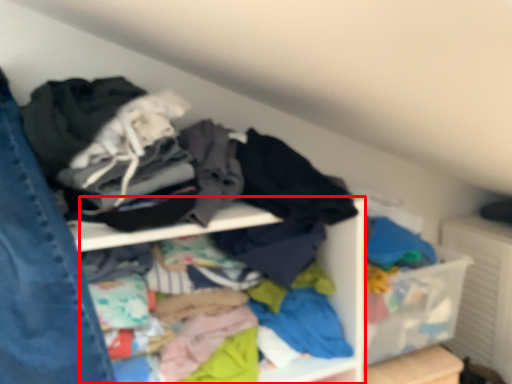
Question: From the image, what is the correct spatial relationship of cabinet (annotated by the red box) in relation to jeans?

Choices:
 (A) left
 (B) right

Answer: (B)